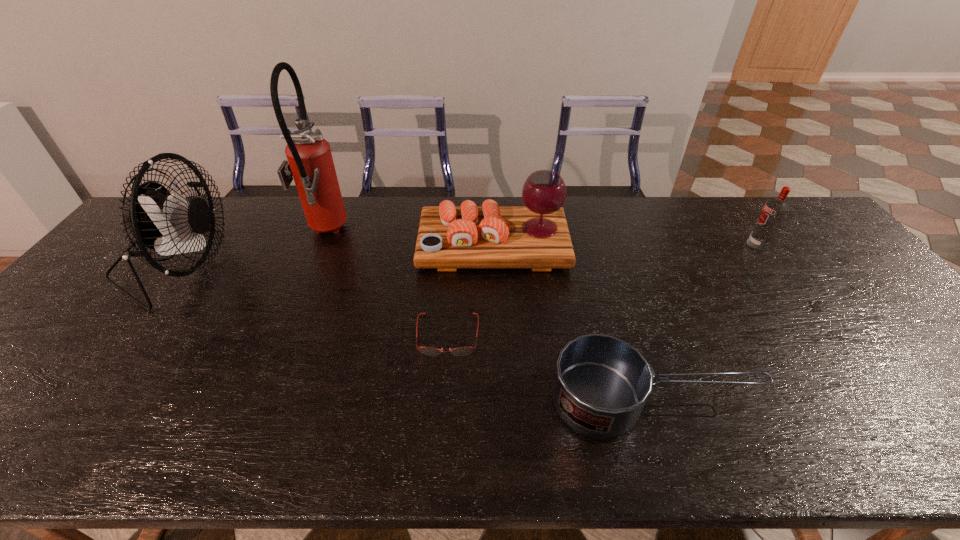
Locate an element on the screen. vodka that is at the far edge is located at coordinates (774, 211).

You are a GUI agent. You are given a task and a screenshot of the screen. Output one action in this format:
    pyautogui.click(x=<x>, y=<y>)
    Task: Click on the object that is at the near edge
    The height and width of the screenshot is (540, 960).
    Given the screenshot: What is the action you would take?
    pyautogui.click(x=601, y=384)

Where is `object present at the left edge`? Image resolution: width=960 pixels, height=540 pixels. object present at the left edge is located at coordinates (158, 220).

The width and height of the screenshot is (960, 540). I want to click on object present at the far left corner, so click(x=158, y=220).

In the image, there is a desktop. Where is `vacant space at the far edge`? The height and width of the screenshot is (540, 960). vacant space at the far edge is located at coordinates pyautogui.click(x=686, y=239).

Identify the location of free region at the near edge of the desktop. The image size is (960, 540). (291, 447).

This screenshot has height=540, width=960. In the image, there is a desktop. In order to click on blank space at the left edge in this screenshot , I will do `click(39, 357)`.

Where is `free space at the right edge of the desktop`? The width and height of the screenshot is (960, 540). free space at the right edge of the desktop is located at coordinates (865, 345).

I want to click on free space between the platter and the tallest object, so click(x=409, y=239).

You are a GUI agent. You are given a task and a screenshot of the screen. Output one action in this format:
    pyautogui.click(x=<x>, y=<y>)
    Task: Click on the vacant area that lies between the rightmost object and the nearest object
    
    Given the screenshot: What is the action you would take?
    pyautogui.click(x=705, y=322)